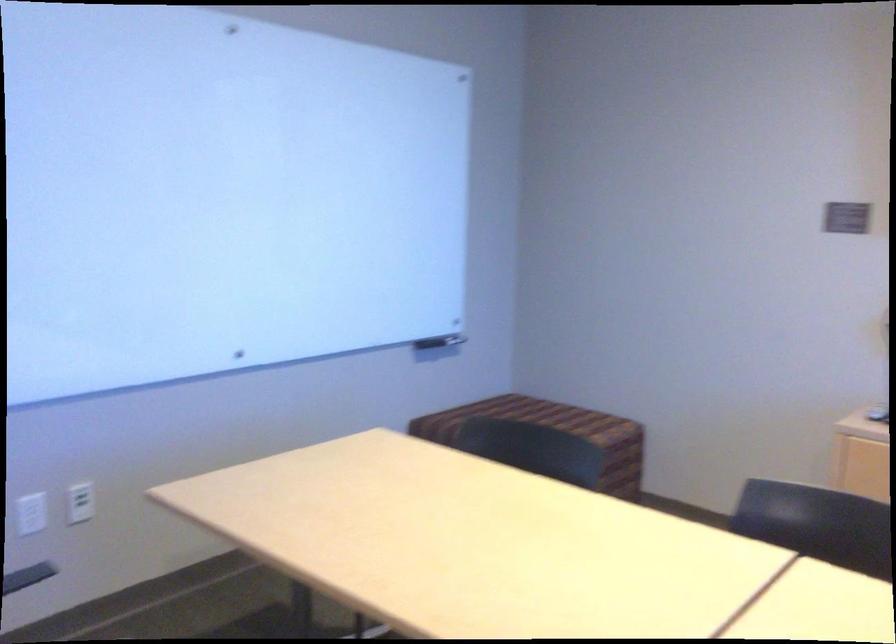
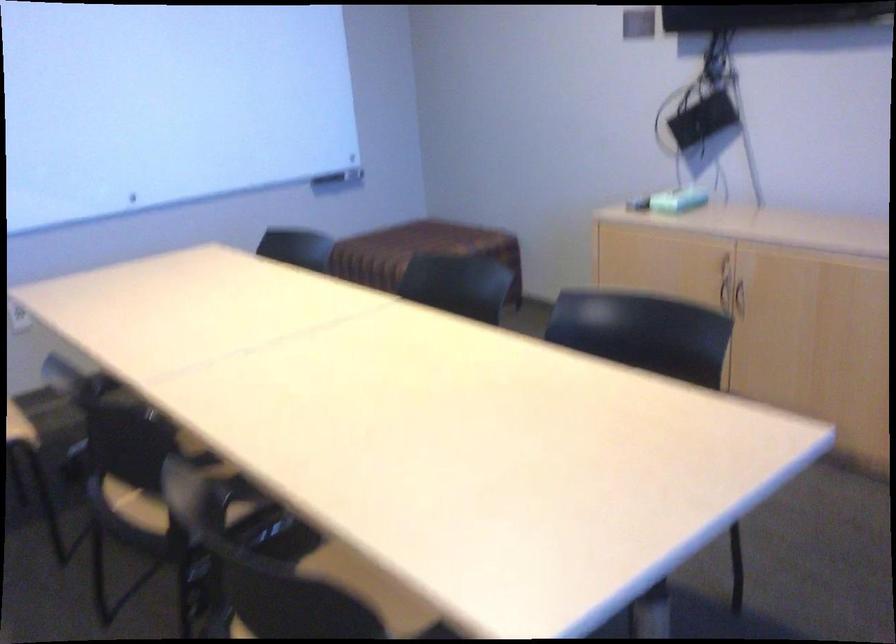
In the second image, find the point that corresponds to pixel 452 345 in the first image.

(339, 178)